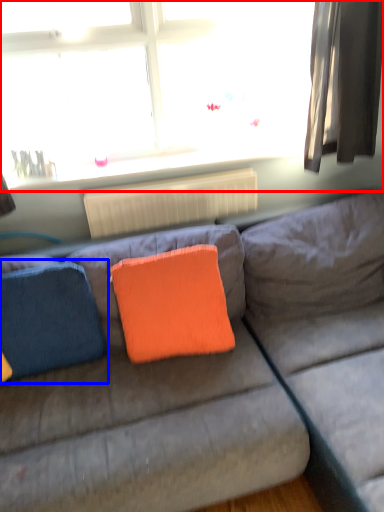
Question: Which object appears farthest to the camera in this image, window (highlighted by a red box) or pillow (highlighted by a blue box)?

Choices:
 (A) window
 (B) pillow

Answer: (A)